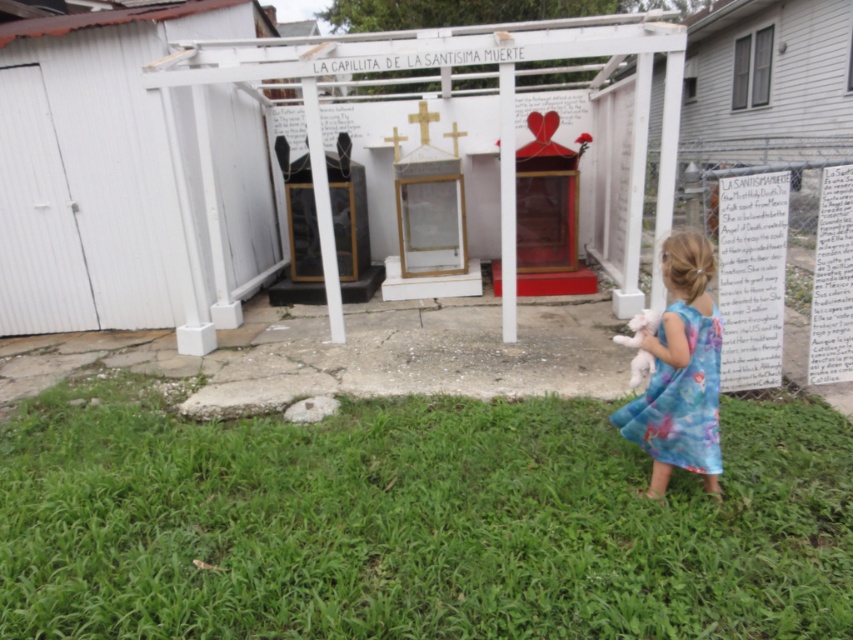
Question: Can you confirm if green grass at lower center is bigger than blue floral dress at lower right?

Choices:
 (A) yes
 (B) no

Answer: (A)

Question: Among these points, which one is nearest to the camera?

Choices:
 (A) (695, 323)
 (B) (122, 451)

Answer: (A)

Question: Which object appears farthest from the camera in this image?

Choices:
 (A) green grass at lower center
 (B) blue floral dress at lower right

Answer: (B)

Question: Is green grass at lower center thinner than blue floral dress at lower right?

Choices:
 (A) yes
 (B) no

Answer: (B)

Question: From the image, what is the correct spatial relationship of green grass at lower center in relation to blue floral dress at lower right?

Choices:
 (A) above
 (B) below

Answer: (B)